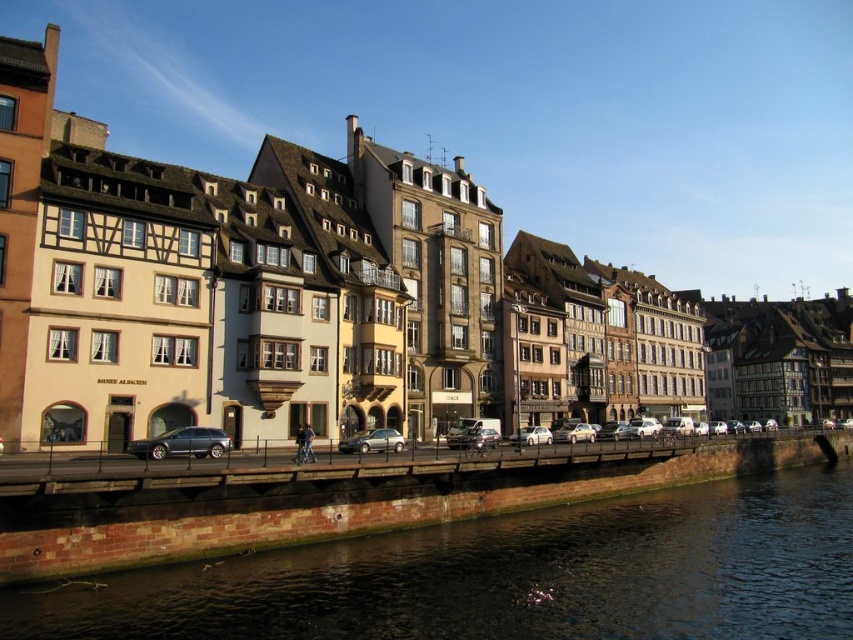
You are a photographer planning to capture both the silver metallic car at center and the white matte car at center in a single frame. Given their sizes, which car will appear larger in the photo?

The white matte car at center will appear larger in the photo because it is bigger than the silver metallic car at center.

You are driving a car and want to park in the riverside area. You see a metallic gray station wagon at center and a silver metallic car at center. Which car is positioned to the left side of the other?

The metallic gray station wagon at center is to the left of the silver metallic car at center.

You are a tour guide leading a group along the riverside. You need to point out both the silver metallic car at center and the white matte car at center to your tourists. Since they are both at the center, how can you describe their positions so that tourists can distinguish them?

The silver metallic car at center and the white matte car at center are 16.77 meters apart from each other. To distinguish them, you can mention that the silver metallic car is to the left of the white matte car, as they are positioned side by side along the riverside path.